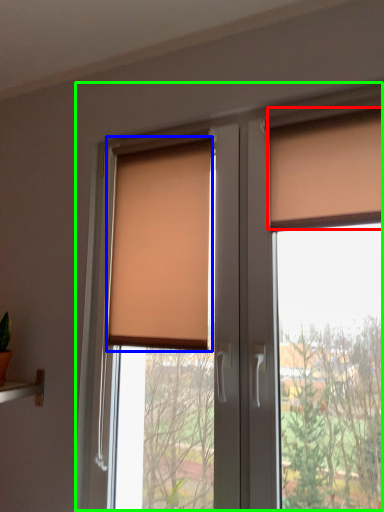
Question: Considering the real-world distances, which object is closest to curtain (highlighted by a red box)? window blind (highlighted by a blue box) or window (highlighted by a green box).

Choices:
 (A) window blind
 (B) window

Answer: (B)